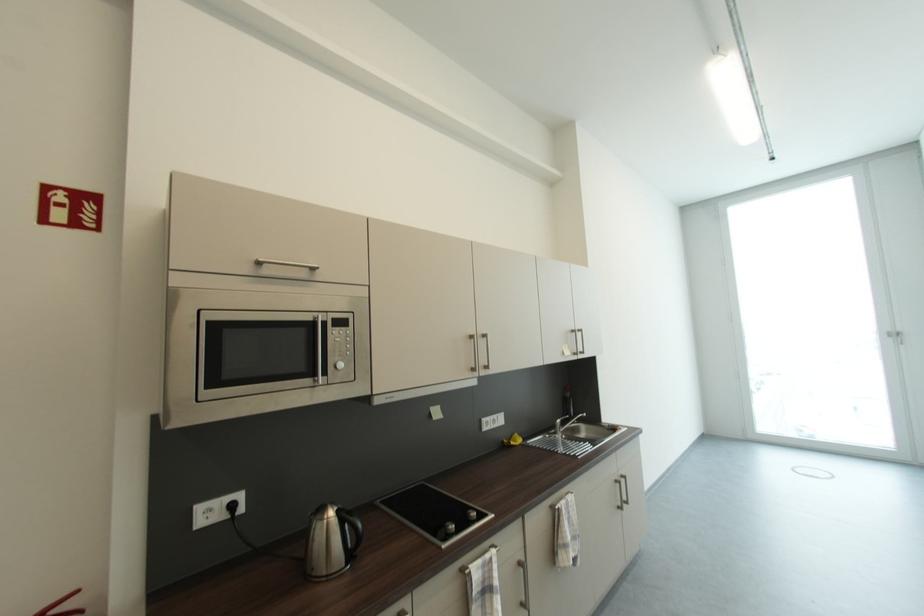
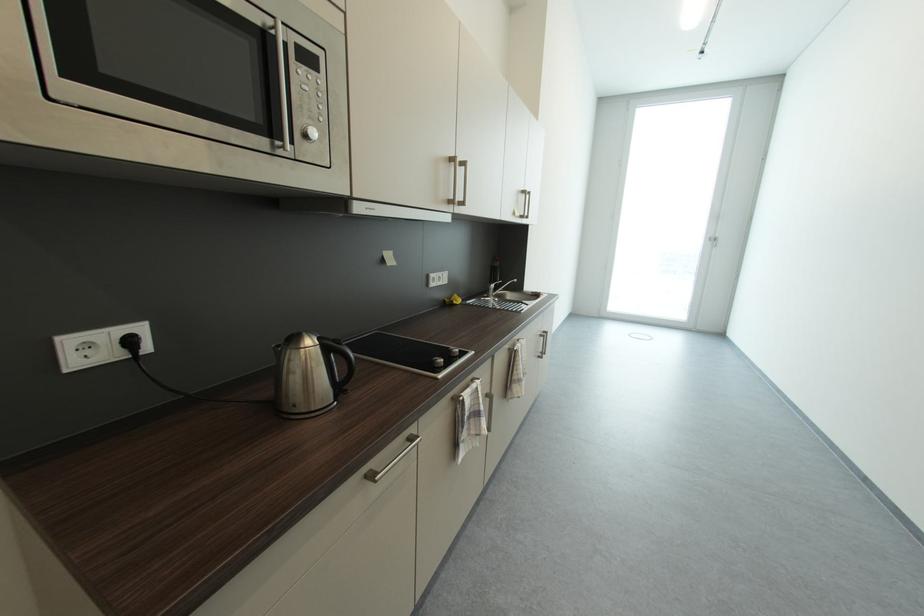
Find the pixel in the second image that matches (565,423) in the first image.

(499, 286)